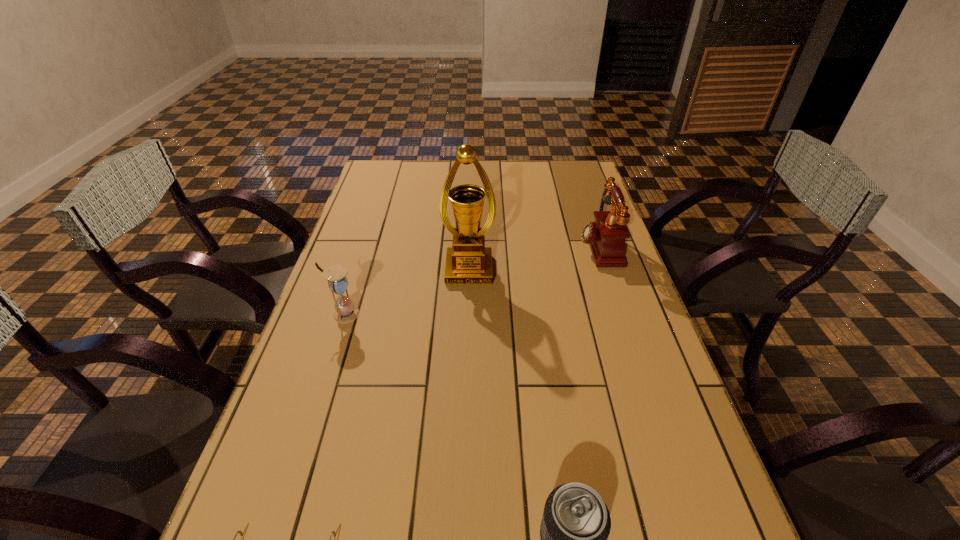
Identify the location of vacant space located 0.150m on the back of the third farthest object. The height and width of the screenshot is (540, 960). (358, 271).

Where is `object at the left edge`? This screenshot has width=960, height=540. object at the left edge is located at coordinates (345, 311).

Where is `object at the right edge`? The height and width of the screenshot is (540, 960). object at the right edge is located at coordinates (606, 236).

Where is `vacant space at the far edge of the desktop`? vacant space at the far edge of the desktop is located at coordinates (467, 167).

Locate an element on the screen. vacant point at the left edge is located at coordinates (362, 231).

Identify the location of vacant space at the right edge of the desktop. The height and width of the screenshot is (540, 960). (624, 314).

The image size is (960, 540). What are the coordinates of `vacant space at the far left corner` in the screenshot? It's located at tap(398, 184).

You are a GUI agent. You are given a task and a screenshot of the screen. Output one action in this format:
    pyautogui.click(x=<x>, y=<y>)
    Task: Click on the free space at the far right corner of the desktop
    The height and width of the screenshot is (540, 960).
    Given the screenshot: What is the action you would take?
    pyautogui.click(x=577, y=175)

You are a GUI agent. You are given a task and a screenshot of the screen. Output one action in this format:
    pyautogui.click(x=<x>, y=<y>)
    Task: Click on the free space that is in between the hourglass and the award
    The image size is (960, 540).
    Given the screenshot: What is the action you would take?
    pyautogui.click(x=406, y=292)

Locate an element on the screen. Image resolution: width=960 pixels, height=540 pixels. unoccupied area between the hourglass and the third object from left to right is located at coordinates (406, 292).